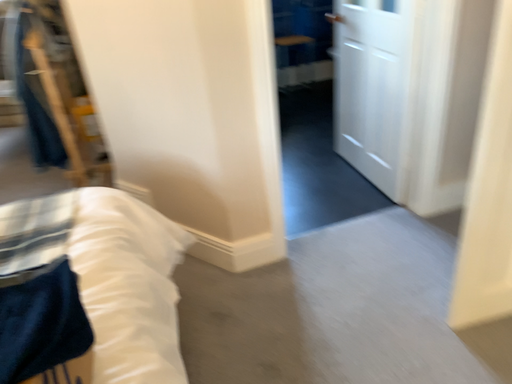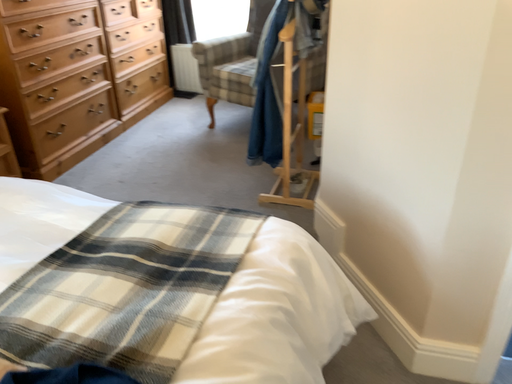
Question: Which way did the camera rotate in the video?

Choices:
 (A) rotated right
 (B) rotated left

Answer: (B)